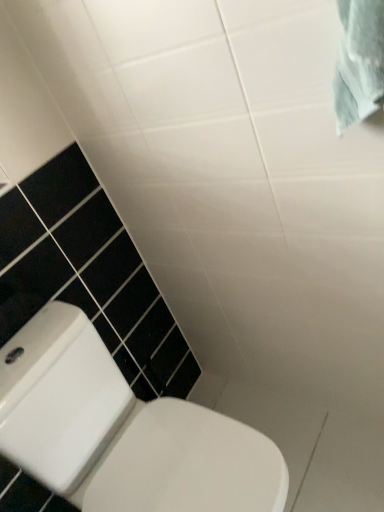
The height and width of the screenshot is (512, 384). I want to click on white glossy toilet at lower left, so click(x=122, y=431).

Describe the element at coordinates (122, 431) in the screenshot. I see `white glossy toilet at lower left` at that location.

What are the coordinates of `white glossy toilet at lower left` in the screenshot? It's located at (122, 431).